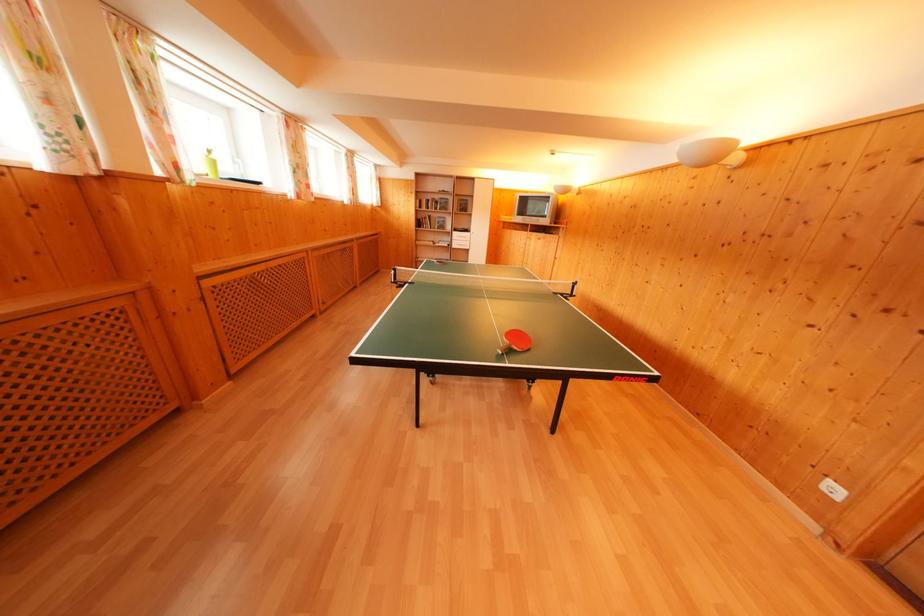
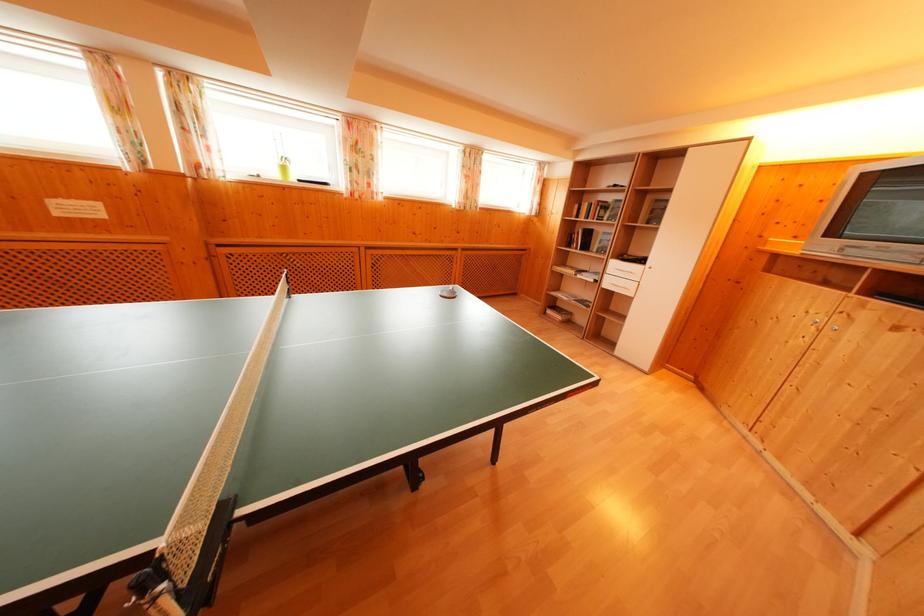
Find the pixel in the second image that matches (x=219, y=168) in the first image.

(288, 174)